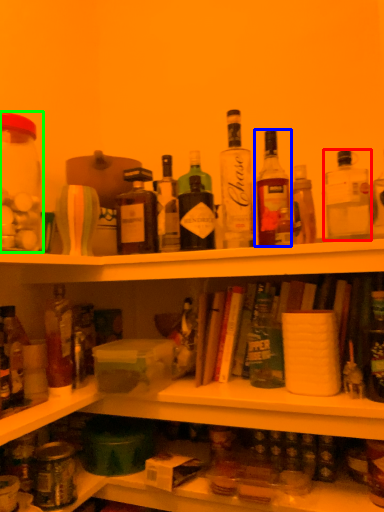
Question: Considering the real-world distances, which object is farthest from bottle (highlighted by a red box)? bottle (highlighted by a blue box) or beverage (highlighted by a green box)?

Choices:
 (A) bottle
 (B) beverage

Answer: (B)